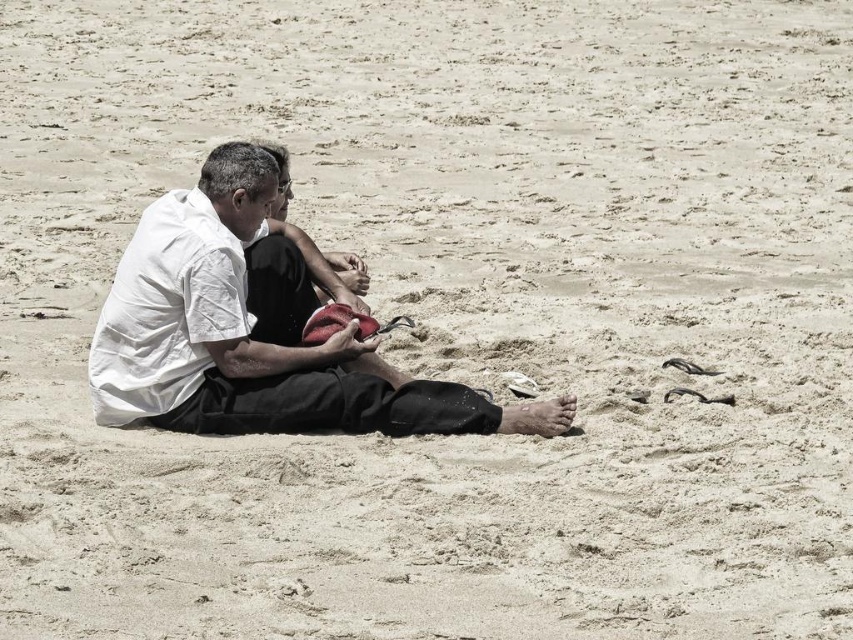
Describe the element at coordinates (257, 330) in the screenshot. The width and height of the screenshot is (853, 640). I see `white cotton shirt at center` at that location.

Which of these two, white cotton shirt at center or black cotton shirt at center, stands shorter?

black cotton shirt at center is shorter.

Is point (538, 416) positioned behind point (283, 147)?

No, it is in front of (283, 147).

Identify the location of white cotton shirt at center. (257, 330).